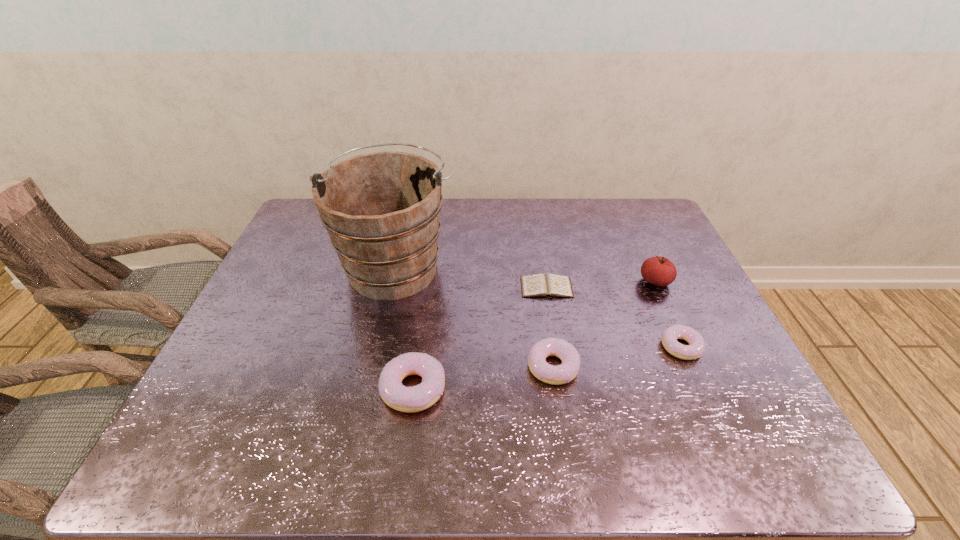
Image resolution: width=960 pixels, height=540 pixels. Find the location of `vacant space situated on the right of the second shortest doughnut`. vacant space situated on the right of the second shortest doughnut is located at coordinates click(615, 367).

In order to click on free region located on the left of the shortest doughnut in this screenshot , I will do `click(522, 347)`.

Where is `blank area located 0.190m on the handle side of the tallest object`? This screenshot has height=540, width=960. blank area located 0.190m on the handle side of the tallest object is located at coordinates (411, 200).

Image resolution: width=960 pixels, height=540 pixels. Find the location of `vacant space located on the handle side of the tallest object`. vacant space located on the handle side of the tallest object is located at coordinates (411, 199).

Image resolution: width=960 pixels, height=540 pixels. Identify the location of free spot located on the right of the diary. point(648,287).

At what (x,y) coordinates should I click in order to perform the action: click on free region located 0.120m on the front of the tomato. Please return your answer as a coordinate pair (x, y). This screenshot has width=960, height=540. Looking at the image, I should click on (674, 323).

Find the location of `object at the far edge`. object at the far edge is located at coordinates (381, 210).

Where is `doughnut present at the right edge`? This screenshot has height=540, width=960. doughnut present at the right edge is located at coordinates (696, 347).

You are a GUI agent. You are given a task and a screenshot of the screen. Output one action in this format:
    pyautogui.click(x=<x>, y=<y>)
    Task: Click on the tomato present at the right edge
    This screenshot has width=960, height=540.
    Given the screenshot: What is the action you would take?
    pyautogui.click(x=659, y=271)

Where is `free spot at the far edge of the desktop`? free spot at the far edge of the desktop is located at coordinates (600, 226).